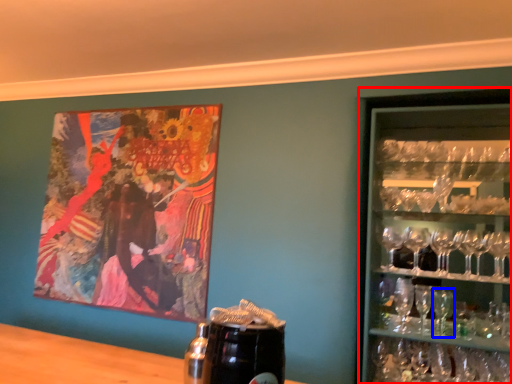
Question: Which point is closer to the camera, shelf (highlighted by a red box) or martini glass (highlighted by a blue box)?

Choices:
 (A) shelf
 (B) martini glass

Answer: (A)